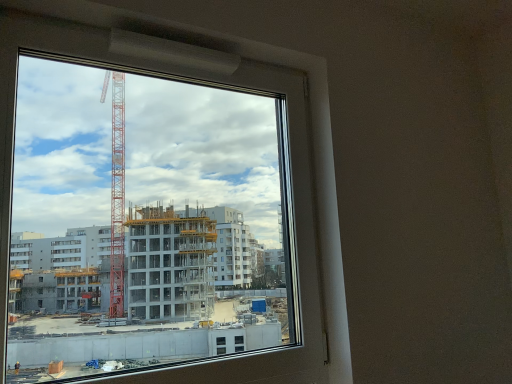
Describe the element at coordinates (292, 175) in the screenshot. I see `transparent glass window at center` at that location.

Measure the distance between point [164,41] and camera.

Point [164,41] is 4.24 feet from camera.

What is the approximate height of transparent glass window at center?

transparent glass window at center is 1.12 meters tall.

The image size is (512, 384). Find the location of `transparent glass window at center`. transparent glass window at center is located at coordinates (292, 175).

Locate an element on the screen. Image resolution: width=512 pixels, height=384 pixels. transparent glass window at center is located at coordinates (292, 175).